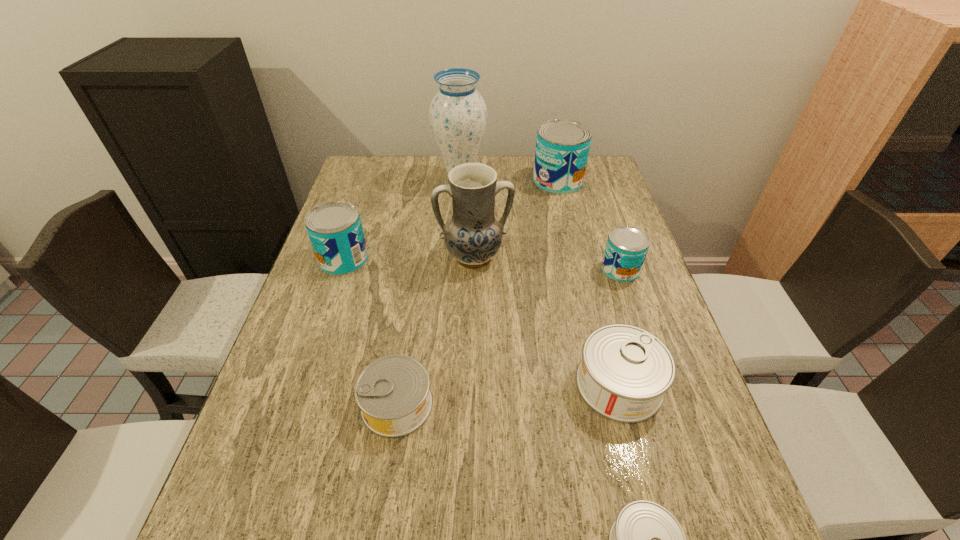
You are a GUI agent. You are given a task and a screenshot of the screen. Output one action in this format:
    pyautogui.click(x=<x>, y=<y>)
    Task: Click on the second biggest silver can
    This screenshot has height=540, width=960.
    Given the screenshot: What is the action you would take?
    pyautogui.click(x=393, y=392)

Identify the location of the fifth tallest can. This screenshot has height=540, width=960. (393, 392).

I want to click on free spot located 0.230m on the left of the blue vase, so click(367, 180).

You are a GUI agent. You are given a task and a screenshot of the screen. Output one action in this format:
    pyautogui.click(x=<x>, y=<y>)
    Task: Click on the vacant area located on the front of the second tallest object
    Image resolution: width=960 pixels, height=540 pixels.
    Given the screenshot: What is the action you would take?
    pyautogui.click(x=471, y=411)

Where is `free location located 0.160m on the front of the tallest can`? The image size is (960, 540). free location located 0.160m on the front of the tallest can is located at coordinates (568, 225).

Image resolution: width=960 pixels, height=540 pixels. I want to click on vacant space located on the back of the leftmost object, so click(352, 232).

Locate an element on the screen. This screenshot has width=960, height=540. free point located 0.160m on the front of the smallest blue can is located at coordinates (640, 330).

Locate an element on the screen. The image size is (960, 540). vacant region located on the left of the biggest silver can is located at coordinates (439, 384).

At what (x,y) coordinates should I click in order to perform the action: click on free point located on the back of the fifth tallest can. Please return your answer as a coordinate pair (x, y). Looking at the image, I should click on (418, 267).

You are a GUI agent. You are given a task and a screenshot of the screen. Output one action in this format:
    pyautogui.click(x=<x>, y=<y>)
    Task: Click on the vase located at the far edge
    The width and height of the screenshot is (960, 540).
    Given the screenshot: What is the action you would take?
    pyautogui.click(x=458, y=114)